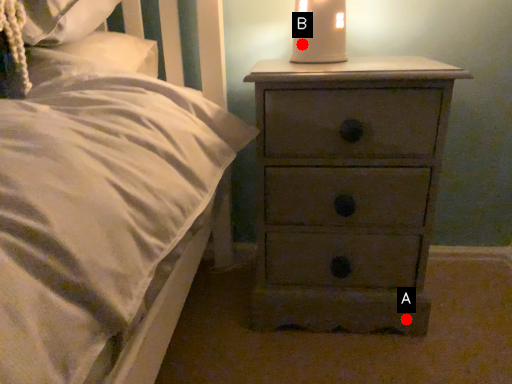
Question: Two points are circled on the image, labeled by A and B beside each circle. Among these points, which one is nearest to the camera?

Choices:
 (A) A is closer
 (B) B is closer

Answer: (B)